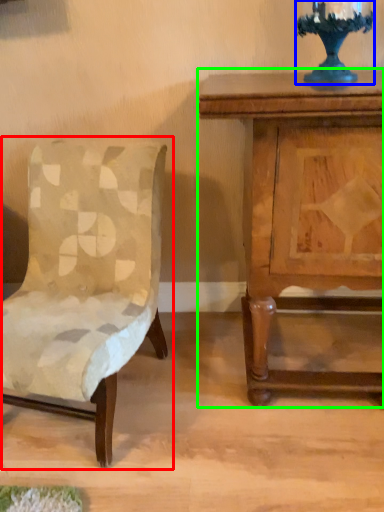
Question: Which object is positioned farthest from chair (highlighted by a red box)? Select from candle holder (highlighted by a blue box) and nightstand (highlighted by a green box).

Choices:
 (A) candle holder
 (B) nightstand

Answer: (A)